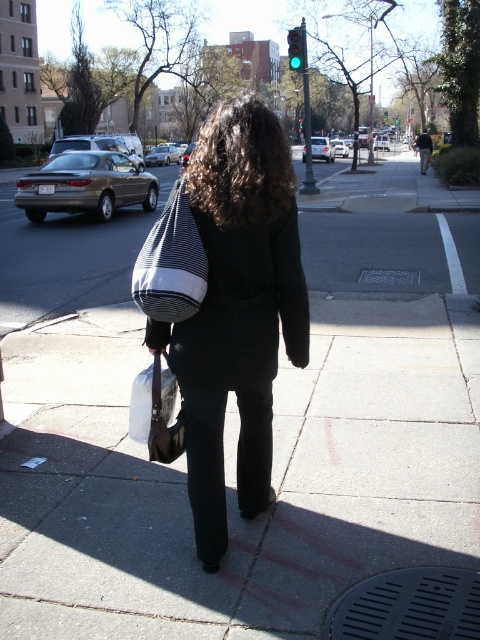
Who is lower down, striped fabric bag at center or green glass traffic light at upper center?

striped fabric bag at center is lower down.

Does striped fabric bag at center have a smaller size compared to green glass traffic light at upper center?

Indeed, striped fabric bag at center has a smaller size compared to green glass traffic light at upper center.

Describe the element at coordinates (170, 262) in the screenshot. This screenshot has width=480, height=640. I see `striped fabric bag at center` at that location.

The image size is (480, 640). I want to click on striped fabric bag at center, so click(x=170, y=262).

Does black fabric bag at center lie in front of green glass traffic light at upper center?

Yes, it is in front of green glass traffic light at upper center.

Between point (262, 477) and point (299, 45), which one is positioned in front?

Point (262, 477) is more forward.

You are a GUI agent. You are given a task and a screenshot of the screen. Output one action in this format:
    pyautogui.click(x=<x>, y=<y>)
    Task: Click on the black fabric bag at center
    The height and width of the screenshot is (640, 480).
    Given the screenshot: What is the action you would take?
    pyautogui.click(x=237, y=308)

Is point (213, 301) positioned before point (146, 294)?

No, it is not.

Describe the element at coordinates (237, 308) in the screenshot. I see `black fabric bag at center` at that location.

Image resolution: width=480 pixels, height=640 pixels. What are the coordinates of `black fabric bag at center` in the screenshot? It's located at (237, 308).